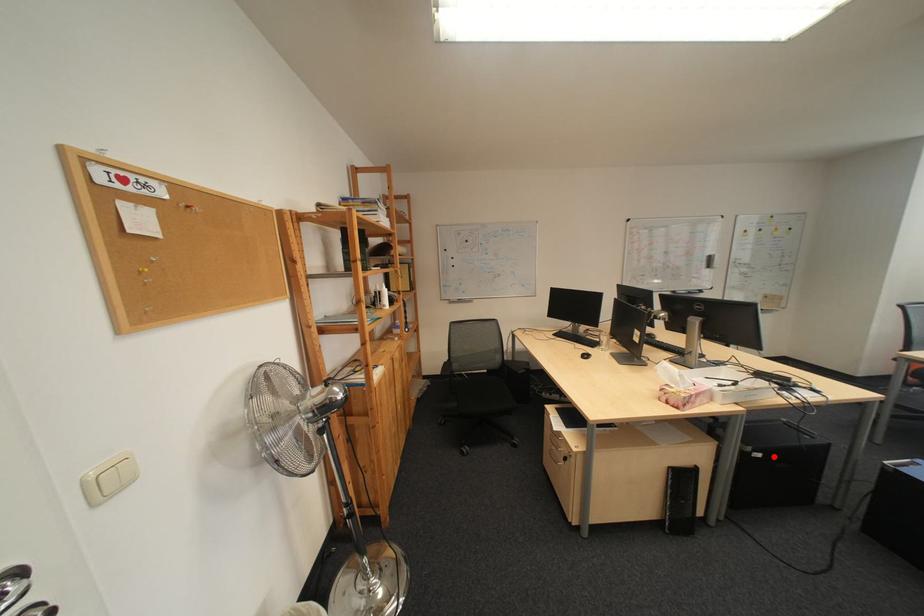
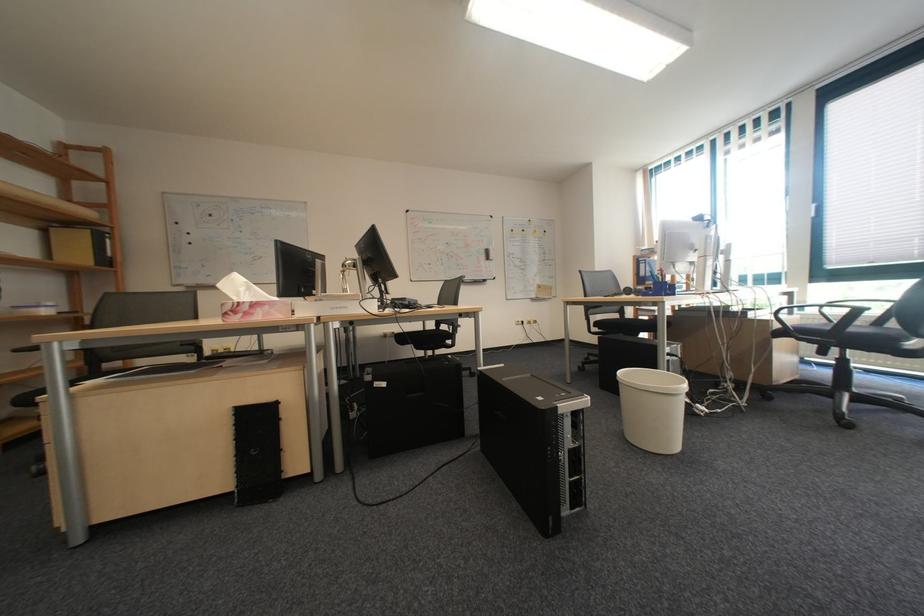
Question: I am providing you with two images of the same scene from different viewpoints. A red point is shown in image1. For the corresponding object point in image2, is it positioned nearer or farther from the camera?

Choices:
 (A) Nearer
 (B) Farther

Answer: (B)